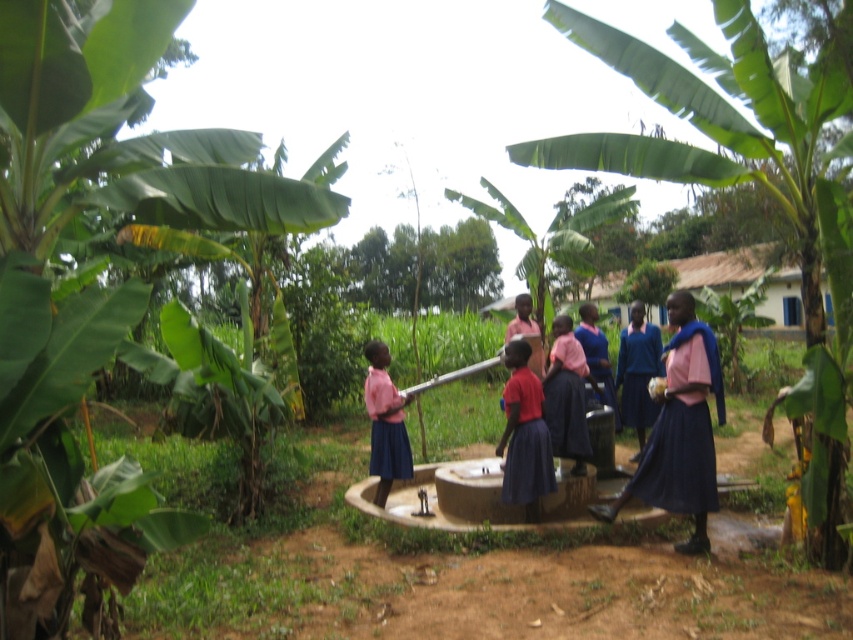
You are a photographer trying to capture a photo of the matte blue skirt at center without the green leafy banana tree at left overlapping it. Based on their widths, can you position yourself in a way that the banana tree is entirely out of the frame while still including the skirt?

The green leafy banana tree at left is wider than the matte blue skirt at center. To avoid the banana tree overlapping the skirt, position yourself so that the tree is outside the frame while keeping the skirt centered. Since the tree is wider, you may need to move sideways or adjust your angle to ensure only the skirt is visible.

You are a photographer trying to capture a photo of the children at the water pump. You want to ensure that both the green leafy banana tree at left and the green leafy banana tree at center are visible in the frame. Based on their sizes, which tree might require you to adjust your camera angle to include more of its width?

The green leafy banana tree at center has a greater width compared to the green leafy banana tree at left, so you might need to adjust your camera angle to include more of its width.

You are a photographer trying to capture a photo of the matte blue skirt at center and the green leafy banana tree at left. Which object should you focus on first if you want to ensure both are in sharp focus?

The green leafy banana tree at left is taller than the matte blue skirt at center, so focusing on the banana tree first will help ensure both are in sharp focus as it is the larger and more distant subject.